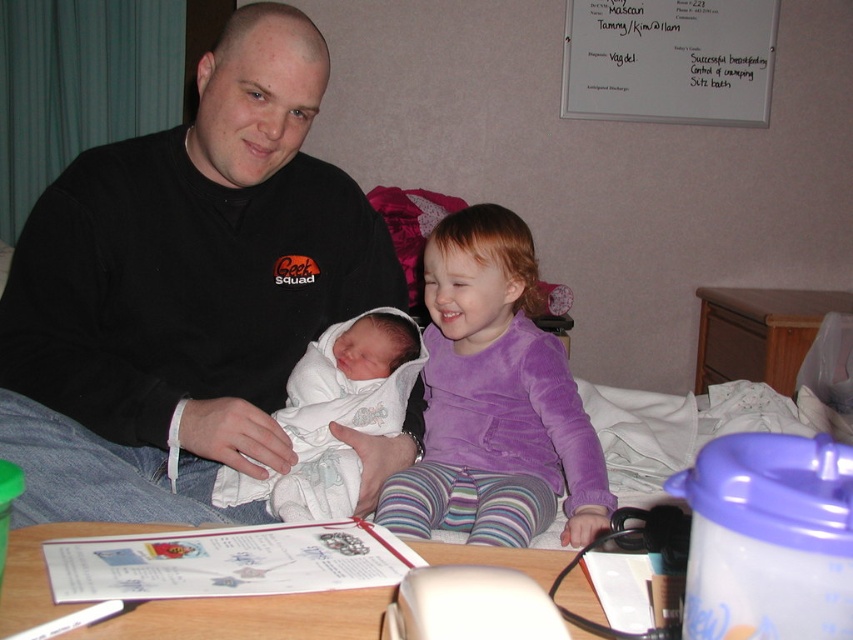
Question: Which point is closer to the camera?

Choices:
 (A) black cotton shirt at upper left
 (B) white plastic table at lower center
 (C) white clothed baby at center

Answer: (B)

Question: Which point is farther from the camera taking this photo?

Choices:
 (A) (172, 317)
 (B) (412, 330)
 (C) (573, 516)
 (D) (316, 620)

Answer: (B)

Question: Is white plastic table at lower center above white clothed baby at center?

Choices:
 (A) no
 (B) yes

Answer: (A)

Question: Is purple velvety shirt at center wider than white clothed baby at center?

Choices:
 (A) no
 (B) yes

Answer: (B)

Question: Which of the following is the closest to the observer?

Choices:
 (A) (457, 410)
 (B) (593, 600)

Answer: (B)

Question: Does white plastic table at lower center appear on the left side of white clothed baby at center?

Choices:
 (A) yes
 (B) no

Answer: (B)